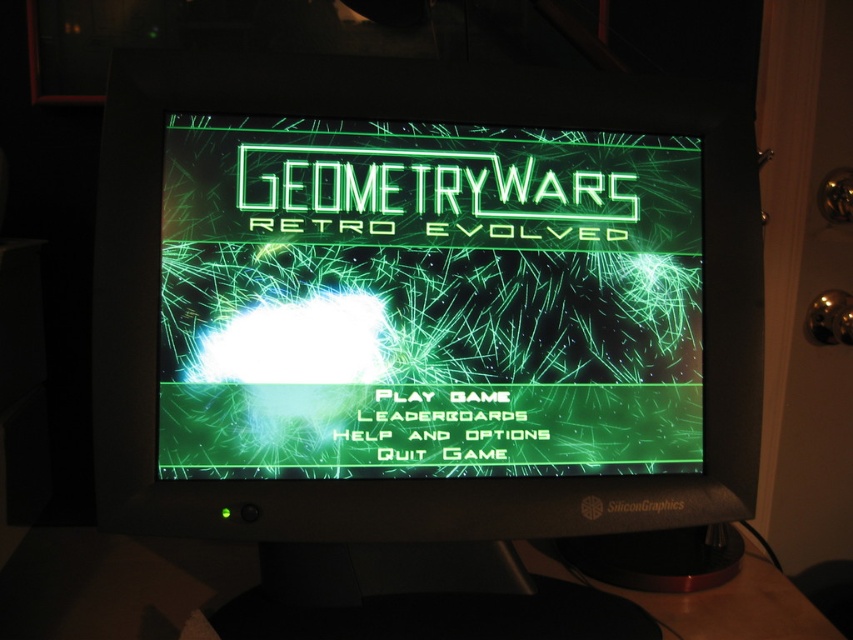
Who is positioned more to the left, green matte text at center or black plastic table at lower center?

From the viewer's perspective, black plastic table at lower center appears more on the left side.

Between point (689, 432) and point (728, 636), which one is positioned in front?

Positioned in front is point (689, 432).

I want to click on green matte text at center, so click(x=427, y=300).